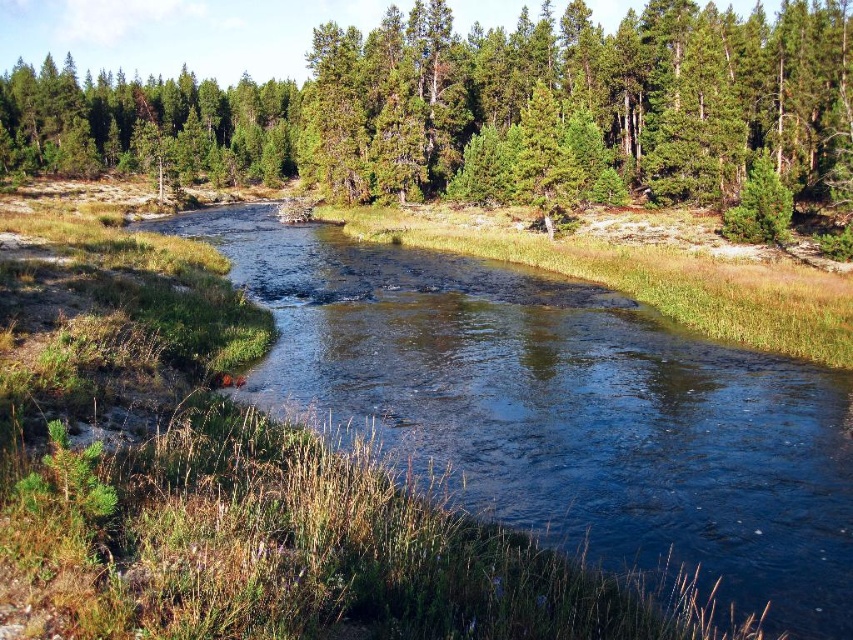
Question: Among these objects, which one is farthest from the camera?

Choices:
 (A) green textured trees at center
 (B) clear water at center
 (C) green matte tree at upper left

Answer: (C)

Question: Is green textured trees at center to the left of green matte tree at upper left from the viewer's perspective?

Choices:
 (A) yes
 (B) no

Answer: (B)

Question: Which point is closer to the camera?

Choices:
 (A) green textured trees at center
 (B) clear water at center
 (C) green matte tree at upper left

Answer: (B)

Question: Is clear water at center to the left of green matte tree at upper left from the viewer's perspective?

Choices:
 (A) no
 (B) yes

Answer: (A)

Question: Is green textured trees at center smaller than green matte tree at upper left?

Choices:
 (A) yes
 (B) no

Answer: (A)

Question: Which of the following is the farthest from the observer?

Choices:
 (A) clear water at center
 (B) green matte tree at upper left
 (C) green textured trees at center

Answer: (B)